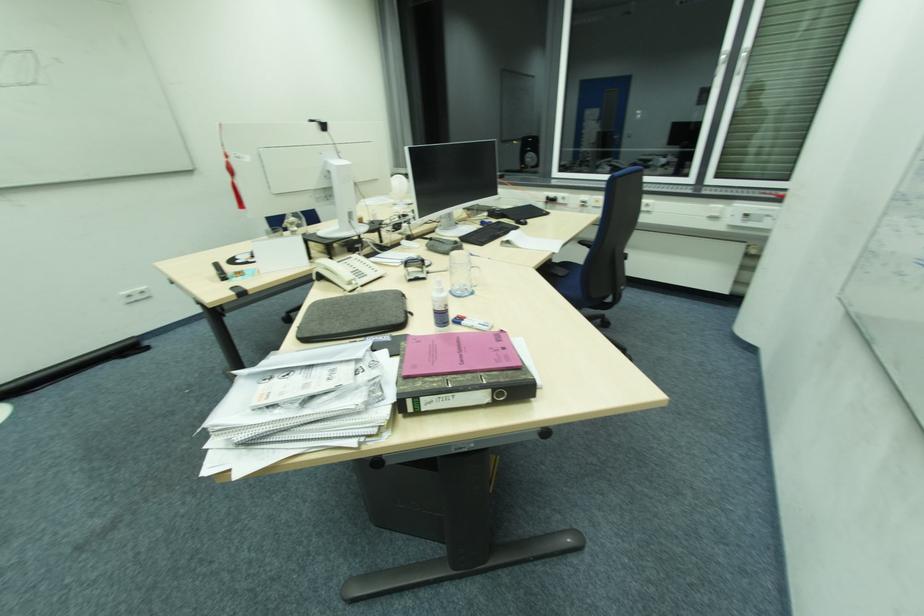
The height and width of the screenshot is (616, 924). Identify the location of black office stamp. (503, 227).